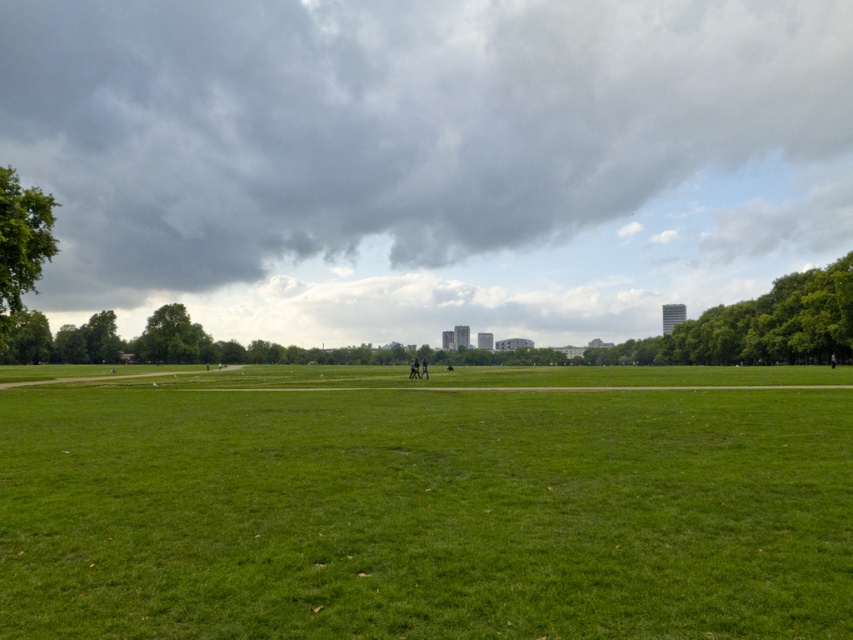
Is point (155, 586) positioned after point (19, 228)?

No.

At what (x,y) coordinates should I click in order to perform the action: click on green grassy field at center. Please return your answer as a coordinate pair (x, y). This screenshot has height=640, width=853. Looking at the image, I should click on (425, 502).

Does point (793, 499) come closer to viewer compared to point (25, 227)?

Yes, it is in front of point (25, 227).

The width and height of the screenshot is (853, 640). What are the coordinates of `green grassy field at center` in the screenshot? It's located at (425, 502).

Which is more to the left, dark gray cloud at upper center or green leafy tree at right?

Positioned to the left is dark gray cloud at upper center.

Does dark gray cloud at upper center have a lesser height compared to green leafy tree at right?

Incorrect, dark gray cloud at upper center's height does not fall short of green leafy tree at right's.

Between point (86, 193) and point (844, 356), which one is positioned in front?

Point (844, 356) is in front.

Identify the location of dark gray cloud at upper center. This screenshot has height=640, width=853. (387, 124).

Is point (525, 518) positioned before point (834, 314)?

Yes, point (525, 518) is closer to viewer.

Which is behind, point (218, 532) or point (721, 312)?

Positioned behind is point (721, 312).

Image resolution: width=853 pixels, height=640 pixels. I want to click on green grassy field at center, so click(425, 502).